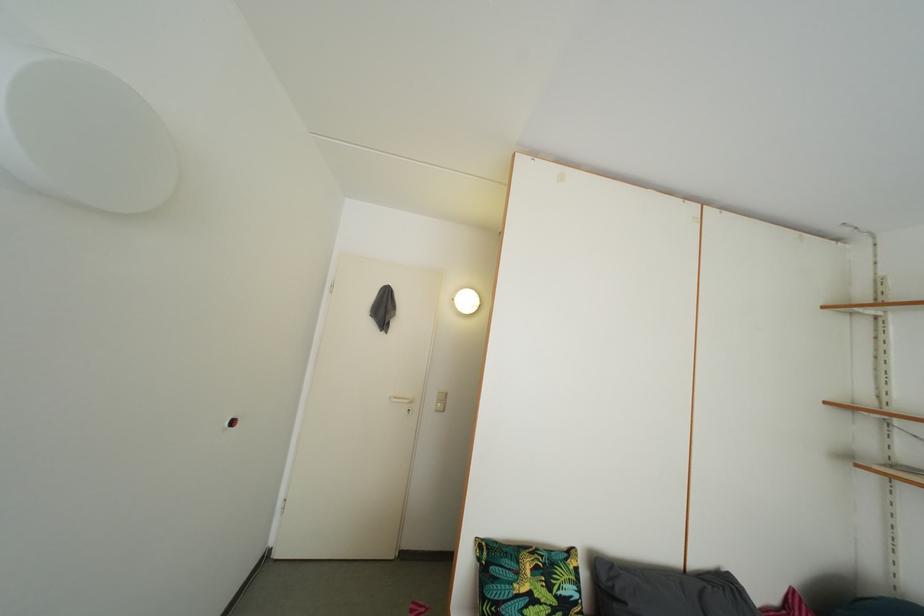
Find where to push the white light switch. Please return your answer as a coordinate pair (x, y).

(440, 400)